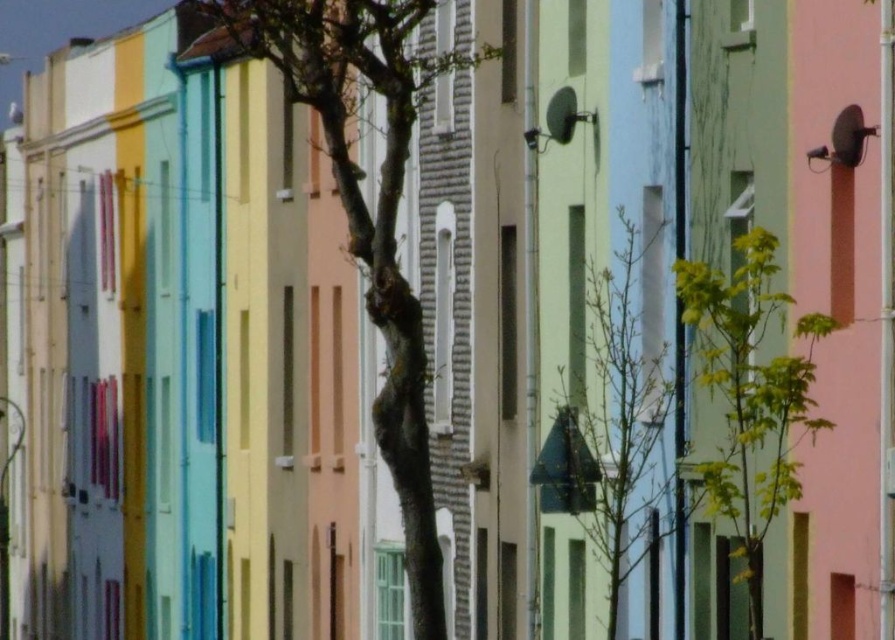
Question: Which point appears farthest from the camera in this image?

Choices:
 (A) (748, 253)
 (B) (620, 305)

Answer: (B)

Question: Can you confirm if smooth bark tree at center is positioned to the left of green leafy tree at right?

Choices:
 (A) yes
 (B) no

Answer: (A)

Question: Does smooth bark tree at center appear over green leafy tree at center?

Choices:
 (A) no
 (B) yes

Answer: (B)

Question: Based on their relative distances, which object is nearer to the green leafy tree at center?

Choices:
 (A) smooth bark tree at center
 (B) green leafy tree at right

Answer: (B)

Question: Is smooth bark tree at center thinner than green leafy tree at right?

Choices:
 (A) no
 (B) yes

Answer: (A)

Question: Which is nearer to the smooth bark tree at center?

Choices:
 (A) green leafy tree at right
 (B) green leafy tree at center

Answer: (B)